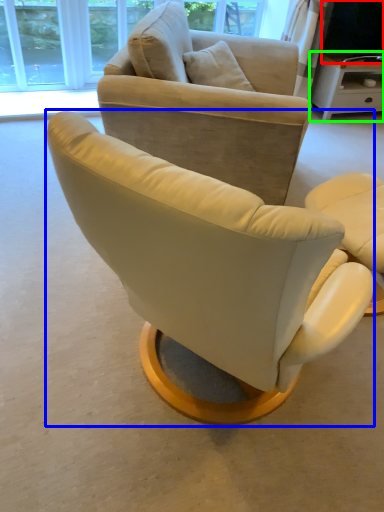
Question: Based on their relative distances, which object is nearer to television (highlighted by a red box)? Choose from chair (highlighted by a blue box) and desk (highlighted by a green box).

Choices:
 (A) chair
 (B) desk

Answer: (B)